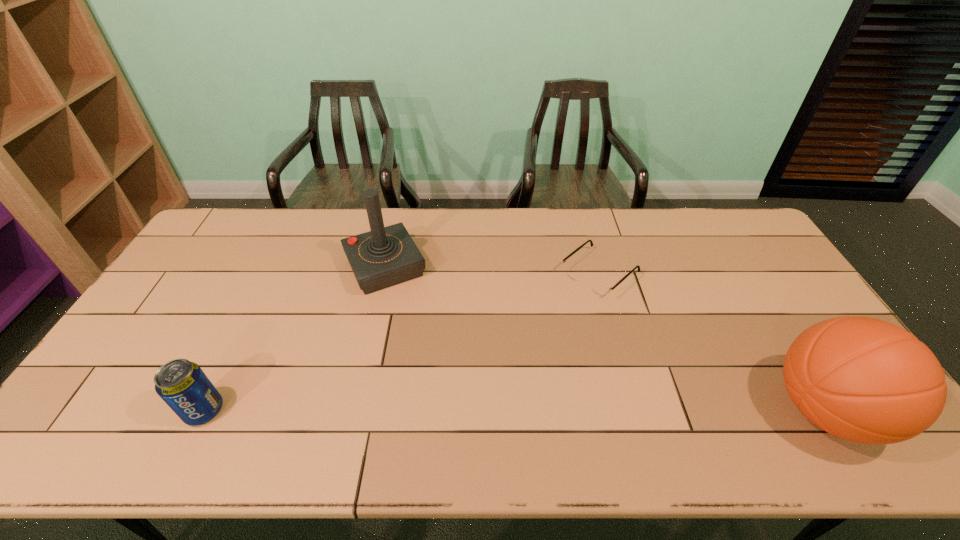
Identify the location of the second shortest object. The width and height of the screenshot is (960, 540). (184, 387).

At what (x,y) coordinates should I click in order to perform the action: click on the leftmost object. Please return your answer as a coordinate pair (x, y). The width and height of the screenshot is (960, 540). Looking at the image, I should click on (184, 387).

Identify the location of basketball. This screenshot has width=960, height=540. (x=865, y=380).

Find the location of a particular element. The width and height of the screenshot is (960, 540). the second object from left to right is located at coordinates (385, 256).

Where is `the third object from left to right`? The image size is (960, 540). the third object from left to right is located at coordinates (597, 287).

Where is `spectacles`? This screenshot has height=540, width=960. spectacles is located at coordinates (597, 287).

The height and width of the screenshot is (540, 960). I want to click on vacant position located on the back of the leftmost object, so click(x=237, y=343).

This screenshot has height=540, width=960. I want to click on free spot located on the back of the basketball, so pyautogui.click(x=751, y=288).

Where is `vacant space located on the rectangular base of the second object from left to right`? The height and width of the screenshot is (540, 960). vacant space located on the rectangular base of the second object from left to right is located at coordinates (428, 352).

Find the location of a particular element. vacant space situated 0.110m on the rectangular base of the second object from left to right is located at coordinates click(412, 319).